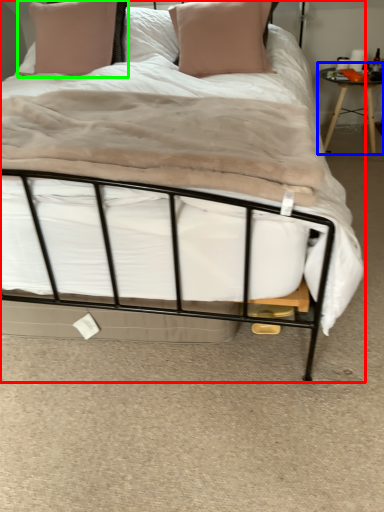
Question: Which object is the closest to the bed (highlighted by a red box)? Choose among these: table (highlighted by a blue box) or pillow (highlighted by a green box).

Choices:
 (A) table
 (B) pillow

Answer: (B)